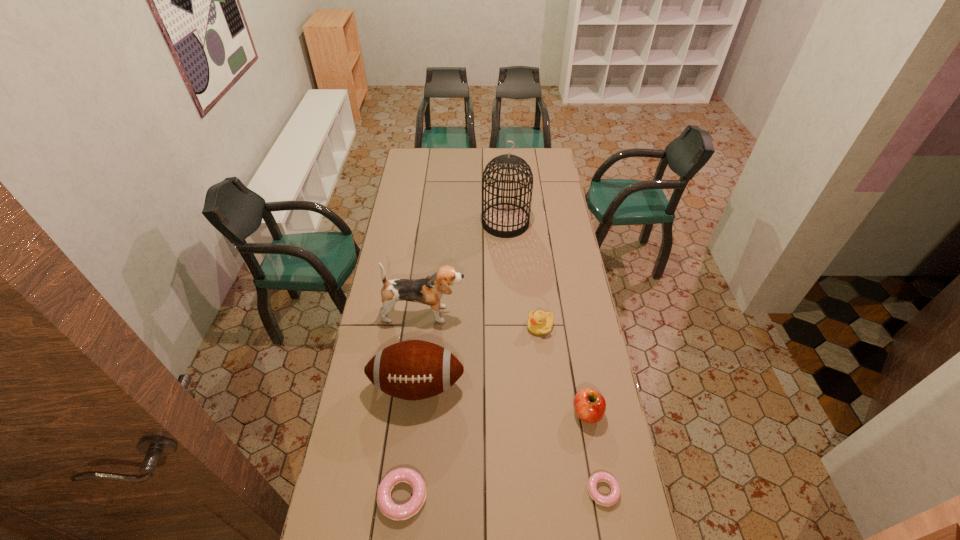
You are a GUI agent. You are given a task and a screenshot of the screen. Output one action in this format:
    pyautogui.click(x=<x>, y=<y>)
    Task: Click on the vacant space located 0.400m on the back of the taller doughnut
    
    Given the screenshot: What is the action you would take?
    pyautogui.click(x=418, y=364)

Find the location of a particular element. The width and height of the screenshot is (960, 540). vacant space located 0.380m on the back of the shortest object is located at coordinates (581, 370).

Where is `vacant space located 0.320m at the face of the puppy`? This screenshot has width=960, height=540. vacant space located 0.320m at the face of the puppy is located at coordinates (541, 314).

I want to click on vacant area located 0.220m on the back of the farthest object, so click(503, 185).

Where is `vacant space located on the beak of the fifth tallest object`? This screenshot has width=960, height=540. vacant space located on the beak of the fifth tallest object is located at coordinates (444, 326).

At what (x,y) coordinates should I click in order to perform the action: click on blank area located on the beak of the fifth tallest object. Please return your answer as a coordinate pair (x, y). The height and width of the screenshot is (540, 960). Looking at the image, I should click on (470, 326).

At what (x,y) coordinates should I click in order to perform the action: click on vacant region located on the beak of the fifth tallest object. Please return your answer as a coordinate pair (x, y). The width and height of the screenshot is (960, 540). Looking at the image, I should click on (486, 326).

What are the coordinates of `free space located on the laces of the third tallest object` in the screenshot? It's located at (411, 442).

At what (x,y) coordinates should I click in order to perform the action: click on free point located on the left of the apple. Please return your answer as a coordinate pair (x, y). The width and height of the screenshot is (960, 540). Looking at the image, I should click on (535, 413).

In order to click on doughnut located at the left edge in this screenshot , I will do `click(391, 510)`.